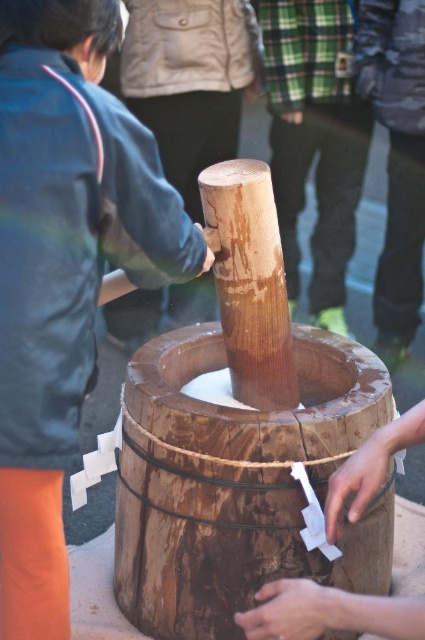
You are standing in a traditional kitchen and see a dark blue jacket at left and a wooden hand at center. Which object is closer to you?

The dark blue jacket at left is closer to you because it is positioned over the wooden hand at center, indicating it is in front.

You are standing at the mortar and pestle scene. There are two points marked in the image. The first point is at coordinates point (x=61, y=296) and the second is at point (x=243, y=538). If you were to walk from the first point to the second, would you be moving towards the background or the foreground of the image?

Since point (x=61, y=296) is in front of point (x=243, y=538), walking from the first to the second point would mean moving towards the background of the image.

You are standing at the point marked as point (238, 483). What object is located at this point?

The wooden barrel at center is located at point (238, 483).